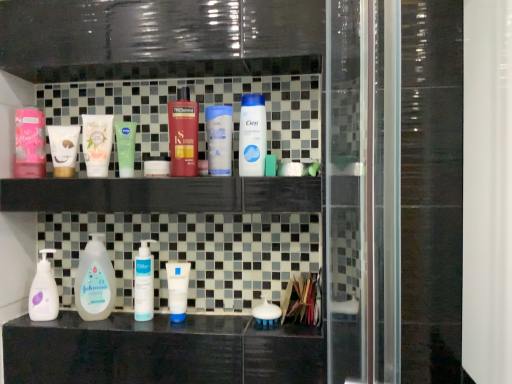
What is the approximate height of white matte tube at center, marked as the 1th mouthwash in a right-to-left arrangement?

It is 6.01 inches.

What is the approximate width of white matte pump bottle at center, which is the 3th cleaning product from left to right?

It is 1.46 inches.

What do you see at coordinates (144, 283) in the screenshot? I see `white matte pump bottle at center, which is the third cleaning product from right to left` at bounding box center [144, 283].

How much space does white matte brush at lower right, marked as the 1th toiletry in a right-to-left arrangement, occupy vertically?

The height of white matte brush at lower right, marked as the 1th toiletry in a right-to-left arrangement, is 2.81 inches.

Locate an element on the screen. The height and width of the screenshot is (384, 512). matte green tube at center, the first mouthwash in the top-to-bottom sequence is located at coordinates (97, 144).

Locate an element on the screen. This screenshot has height=384, width=512. white glossy bottle at upper center, which appears as the 1th cleaning product when viewed from the right is located at coordinates (252, 135).

From a real-world perspective, is white glossy bottle at upper center, the fifth cleaning product viewed from the left, above or below shiny red plastic bottle at center, which appears as the 2th cleaning product when viewed from the right?

Clearly, from a real-world perspective, white glossy bottle at upper center, the fifth cleaning product viewed from the left, is below shiny red plastic bottle at center, which appears as the 2th cleaning product when viewed from the right.

Is white glossy bottle at upper center, which appears as the 1th cleaning product when viewed from the right, not inside shiny red plastic bottle at center, the 4th cleaning product positioned from the left?

That's correct, white glossy bottle at upper center, which appears as the 1th cleaning product when viewed from the right, is outside of shiny red plastic bottle at center, the 4th cleaning product positioned from the left.

Does white glossy bottle at upper center, which appears as the 1th cleaning product when viewed from the right, have a lesser width compared to shiny red plastic bottle at center, the 4th cleaning product positioned from the left?

Yes, white glossy bottle at upper center, which appears as the 1th cleaning product when viewed from the right, is thinner than shiny red plastic bottle at center, the 4th cleaning product positioned from the left.

Between white glossy bottle at upper center, the fifth cleaning product viewed from the left, and shiny red plastic bottle at center, the 4th cleaning product positioned from the left, which one appears on the left side from the viewer's perspective?

Positioned to the left is shiny red plastic bottle at center, the 4th cleaning product positioned from the left.

In terms of size, does white matte pump bottle at center, which is the third cleaning product from right to left, appear bigger or smaller than white matte pump bottle at lower left, acting as the 5th cleaning product starting from the right?

Considering their sizes, white matte pump bottle at center, which is the third cleaning product from right to left, takes up less space than white matte pump bottle at lower left, acting as the 5th cleaning product starting from the right.

From a real-world perspective, which is physically below, white matte pump bottle at center, which is the 3th cleaning product from left to right, or white matte pump bottle at lower left, acting as the 5th cleaning product starting from the right?

In real-world perspective, white matte pump bottle at lower left, acting as the 5th cleaning product starting from the right, is lower.

Which point is more forward, (x=138, y=268) or (x=34, y=277)?

The point (x=34, y=277) is closer.

How many degrees apart are the facing directions of white matte pump bottle at lower left, acting as the 5th cleaning product starting from the right, and white matte tube at center, which appears as the third mouthwash when viewed from the left?

0.00296 degrees separate the facing orientations of white matte pump bottle at lower left, acting as the 5th cleaning product starting from the right, and white matte tube at center, which appears as the third mouthwash when viewed from the left.

From a real-world perspective, is white matte pump bottle at lower left, acting as the 5th cleaning product starting from the right, below white matte tube at center, marked as the 1th mouthwash in a right-to-left arrangement?

Incorrect, from a real-world perspective, white matte pump bottle at lower left, acting as the 5th cleaning product starting from the right, is higher than white matte tube at center, marked as the 1th mouthwash in a right-to-left arrangement.

Which is correct: white matte pump bottle at lower left, the first cleaning product from the left, is inside white matte tube at center, marked as the 1th mouthwash in a right-to-left arrangement, or outside of it?

white matte pump bottle at lower left, the first cleaning product from the left, is located beyond the bounds of white matte tube at center, marked as the 1th mouthwash in a right-to-left arrangement.

Identify the location of mouthwash lying below the white matte pump bottle at lower left, the first cleaning product from the left (from the image's perspective). (177, 289).

Based on their positions, is matte pink lotion at left, which ranks as the second toiletry in top-to-bottom order, located to the left or right of matte green tube at center, the 3th mouthwash positioned from the right?

Clearly, matte pink lotion at left, which ranks as the second toiletry in top-to-bottom order, is on the left of matte green tube at center, the 3th mouthwash positioned from the right, in the image.

Based on the photo, from the image's perspective, does matte pink lotion at left, positioned as the 4th toiletry in right-to-left order, appear higher than matte green tube at center, the 3th mouthwash positioned from the right?

Yes, from the image's perspective, matte pink lotion at left, positioned as the 4th toiletry in right-to-left order, is over matte green tube at center, the 3th mouthwash positioned from the right.

Between matte pink lotion at left, positioned as the 4th toiletry in right-to-left order, and matte green tube at center, the 3th mouthwash in the bottom-to-top sequence, which one has smaller width?

matte pink lotion at left, positioned as the 4th toiletry in right-to-left order, is thinner.

Measure the distance from white matte johnson's baby lotion at lower left, which is the 4th cleaning product in right-to-left order, to green matte tube at upper center, which is the second mouthwash from left to right.

white matte johnson's baby lotion at lower left, which is the 4th cleaning product in right-to-left order, is 11.04 inches away from green matte tube at upper center, which is the second mouthwash from left to right.

Does white matte johnson's baby lotion at lower left, the second cleaning product positioned from the left, come behind green matte tube at upper center, positioned as the 2th mouthwash in top-to-bottom order?

Yes, white matte johnson's baby lotion at lower left, the second cleaning product positioned from the left, is behind green matte tube at upper center, positioned as the 2th mouthwash in top-to-bottom order.

Considering the sizes of white matte johnson's baby lotion at lower left, the second cleaning product positioned from the left, and green matte tube at upper center, marked as the second mouthwash in a right-to-left arrangement, in the image, is white matte johnson's baby lotion at lower left, the second cleaning product positioned from the left, wider or thinner than green matte tube at upper center, marked as the second mouthwash in a right-to-left arrangement,?

white matte johnson's baby lotion at lower left, the second cleaning product positioned from the left, is wider than green matte tube at upper center, marked as the second mouthwash in a right-to-left arrangement.

Which is further, (78, 277) or (131, 146)?

Positioned behind is point (78, 277).

Does white glossy bottle at upper center, which appears as the 1th cleaning product when viewed from the right, touch white matte pump bottle at center, which is the third cleaning product from right to left?

No.

Is white glossy bottle at upper center, which appears as the 1th cleaning product when viewed from the right, taller than white matte pump bottle at center, which is the 3th cleaning product from left to right?

Yes.

Consider the image. Between white glossy bottle at upper center, the fifth cleaning product viewed from the left, and white matte pump bottle at center, which is the 3th cleaning product from left to right, which one is positioned in front?

white glossy bottle at upper center, the fifth cleaning product viewed from the left.

Looking at the image, does white glossy bottle at upper center, the fifth cleaning product viewed from the left, seem bigger or smaller compared to white matte pump bottle at center, which is the third cleaning product from right to left?

white glossy bottle at upper center, the fifth cleaning product viewed from the left, is bigger than white matte pump bottle at center, which is the third cleaning product from right to left.

From a real-world perspective, which is physically below, shiny red plastic bottle at center, the 4th cleaning product positioned from the left, or white matte johnson's baby lotion at lower left, the second cleaning product positioned from the left?

From a 3D spatial view, white matte johnson's baby lotion at lower left, the second cleaning product positioned from the left, is below.

Is shiny red plastic bottle at center, the 4th cleaning product positioned from the left, looking in the opposite direction of white matte johnson's baby lotion at lower left, which is the 4th cleaning product in right-to-left order?

No, shiny red plastic bottle at center, the 4th cleaning product positioned from the left, is not facing the opposite direction of white matte johnson's baby lotion at lower left, which is the 4th cleaning product in right-to-left order.

Are shiny red plastic bottle at center, which appears as the 2th cleaning product when viewed from the right, and white matte johnson's baby lotion at lower left, the second cleaning product positioned from the left, beside each other?

No, shiny red plastic bottle at center, which appears as the 2th cleaning product when viewed from the right, is not touching white matte johnson's baby lotion at lower left, the second cleaning product positioned from the left.

Locate an element on the screen. Image resolution: width=512 pixels, height=384 pixels. cleaning product above the white glossy bottle at upper center, the fifth cleaning product viewed from the left (from the image's perspective) is located at coordinates (183, 135).

Find the location of `cleaning product that is the 1st one above the white matte pump bottle at lower left, acting as the 5th cleaning product starting from the right (from a real-world perspective)`. cleaning product that is the 1st one above the white matte pump bottle at lower left, acting as the 5th cleaning product starting from the right (from a real-world perspective) is located at coordinates (144, 283).

Considering their positions, is matte green tube at center, the 3th mouthwash in the bottom-to-top sequence, positioned closer to white matte pump bottle at lower left, the first cleaning product from the left, than shiny red plastic bottle at center, which appears as the 2th cleaning product when viewed from the right?

Among the two, matte green tube at center, the 3th mouthwash in the bottom-to-top sequence, is located nearer to white matte pump bottle at lower left, the first cleaning product from the left.

Looking at the image, which one is located closer to matte pink lotion at left, the first toiletry when ordered from left to right, white matte tube at center, which appears as the third mouthwash when viewed from the left, or white matte tube at center, which ranks as the first toiletry in top-to-bottom order?

Based on the image, white matte tube at center, which ranks as the first toiletry in top-to-bottom order, appears to be nearer to matte pink lotion at left, the first toiletry when ordered from left to right.

Estimate the real-world distances between objects in this image. Which object is closer to white matte tube at center, which appears as the third mouthwash when viewed from the left, white matte tube at center, acting as the 3th toiletry starting from the right, or white matte brush at lower right, which ranks as the 1th toiletry in bottom-to-top order?

white matte brush at lower right, which ranks as the 1th toiletry in bottom-to-top order, is positioned closer to the anchor white matte tube at center, which appears as the third mouthwash when viewed from the left.

Estimate the real-world distances between objects in this image. Which object is further from green matte tube at upper center, which is the second mouthwash from left to right, white glossy bottle at upper center, the fifth cleaning product viewed from the left, or white matte tube at center, positioned as the third mouthwash in top-to-bottom order?

white matte tube at center, positioned as the third mouthwash in top-to-bottom order, lies further to green matte tube at upper center, which is the second mouthwash from left to right, than the other object.

From the picture: From the image, which object appears to be nearer to matte pink lotion at left, which ranks as the second toiletry in top-to-bottom order, white matte tube at center, arranged as the 4th toiletry when ordered from the bottom, or shiny red plastic bottle at center, the 4th cleaning product positioned from the left?

Based on the image, shiny red plastic bottle at center, the 4th cleaning product positioned from the left, appears to be nearer to matte pink lotion at left, which ranks as the second toiletry in top-to-bottom order.

Considering their positions, is white matte pump bottle at lower left, acting as the 5th cleaning product starting from the right, positioned closer to matte pink lotion at left, the first toiletry when ordered from left to right, than shiny red plastic bottle at center, the 4th cleaning product positioned from the left?

Based on the image, white matte pump bottle at lower left, acting as the 5th cleaning product starting from the right, appears to be nearer to matte pink lotion at left, the first toiletry when ordered from left to right.

From the picture: Which object lies further to the anchor point green matte tube at upper center, the second mouthwash positioned from the bottom, white matte tube at center, which appears as the third mouthwash when viewed from the left, or white glossy bottle at upper center, which appears as the 1th cleaning product when viewed from the right?

Based on the image, white matte tube at center, which appears as the third mouthwash when viewed from the left, appears to be further to green matte tube at upper center, the second mouthwash positioned from the bottom.

Consider the image. Based on their spatial positions, is white matte tube at center, acting as the 3th toiletry starting from the right, or green matte tube at upper center, the second mouthwash positioned from the bottom, closer to white glossy bottle at upper center, which appears as the 1th cleaning product when viewed from the right?

green matte tube at upper center, the second mouthwash positioned from the bottom, lies closer to white glossy bottle at upper center, which appears as the 1th cleaning product when viewed from the right, than the other object.

Find the location of `mouthwash located between white matte pump bottle at center, which is the third cleaning product from right to left, and white matte brush at lower right, arranged as the 4th toiletry when viewed from the top, in the left-right direction`. mouthwash located between white matte pump bottle at center, which is the third cleaning product from right to left, and white matte brush at lower right, arranged as the 4th toiletry when viewed from the top, in the left-right direction is located at coordinates (177, 289).

Locate an element on the screen. toiletry that lies between matte pink lotion at left, which ranks as the second toiletry in top-to-bottom order, and white matte pump bottle at center, which is the third cleaning product from right to left, from top to bottom is located at coordinates (63, 149).

The image size is (512, 384). What are the coordinates of `mouthwash that lies between matte green tube at center, positioned as the first mouthwash in left-to-right order, and white matte tube at center, positioned as the third mouthwash in top-to-bottom order, from top to bottom` in the screenshot? It's located at (125, 147).

At what (x,y) coordinates should I click in order to perform the action: click on cleaning product between shiny red plastic bottle at center, the 4th cleaning product positioned from the left, and white matte johnson's baby lotion at lower left, which is the 4th cleaning product in right-to-left order, from top to bottom. Please return your answer as a coordinate pair (x, y). The width and height of the screenshot is (512, 384). Looking at the image, I should click on (252, 135).